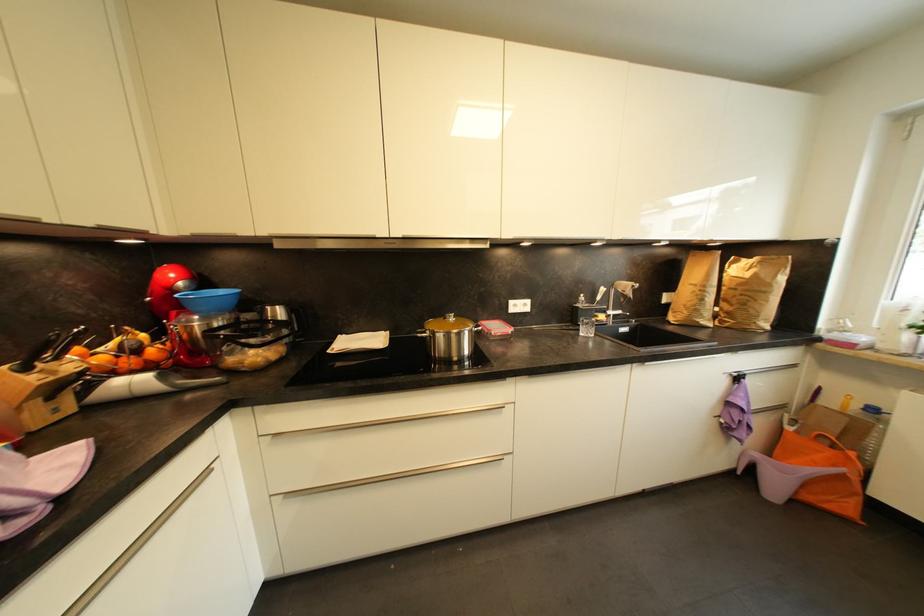
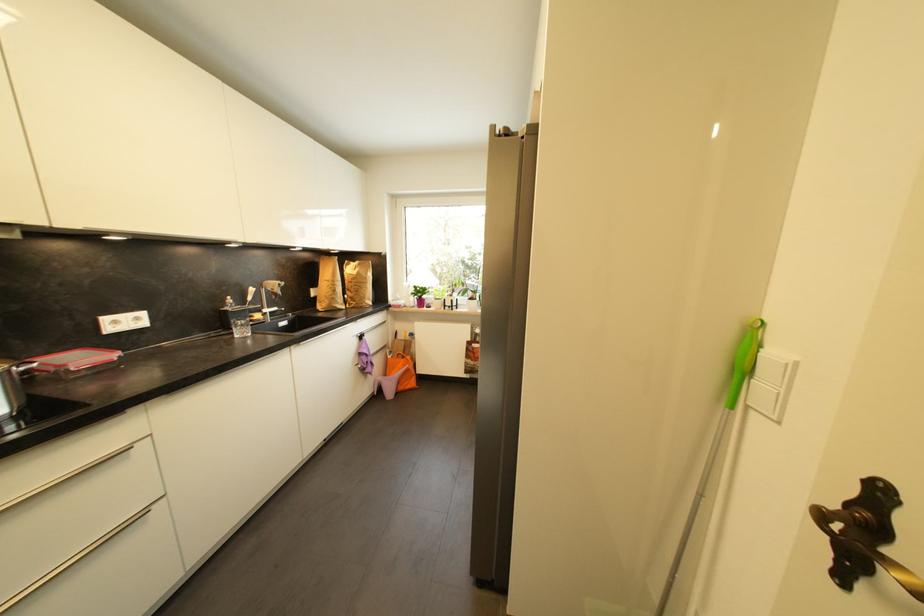
Question: The camera is either moving clockwise (left) or counter-clockwise (right) around the object. The first image is from the beginning of the video and the second image is from the end. Is the camera moving left or right when shooting the video?

Choices:
 (A) Left
 (B) Right

Answer: (A)